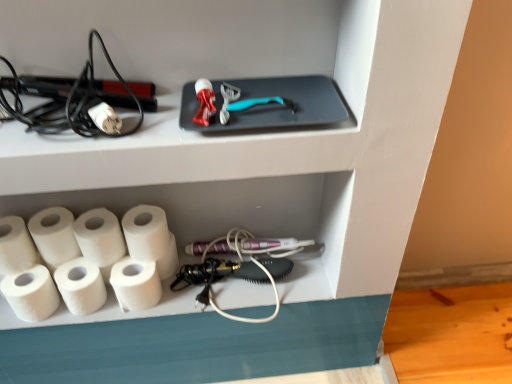
Image resolution: width=512 pixels, height=384 pixels. Describe the element at coordinates (234, 216) in the screenshot. I see `white matte toilet paper rolls at lower left` at that location.

How much space does white matte paper towel at lower left, placed as the 2th paper towel when sorted from right to left, occupy horizontally?

It is 3.84 inches.

Image resolution: width=512 pixels, height=384 pixels. Describe the element at coordinates (136, 284) in the screenshot. I see `white matte paper towel at lower left, placed as the 2th paper towel when sorted from right to left` at that location.

The width and height of the screenshot is (512, 384). What do you see at coordinates (31, 293) in the screenshot? I see `white matte paper towel at lower left, arranged as the 6th paper towel when viewed from the right` at bounding box center [31, 293].

Describe the element at coordinates (54, 236) in the screenshot. Image resolution: width=512 pixels, height=384 pixels. I see `white matte paper towel at lower left, which ranks as the fifth paper towel in right-to-left order` at that location.

The width and height of the screenshot is (512, 384). What are the coordinates of `white matte paper towel at lower left, the 7th paper towel from the right` in the screenshot? It's located at (15, 246).

The width and height of the screenshot is (512, 384). Identify the location of white matte paper towel at lower left, acting as the third paper towel starting from the right. (100, 237).

Based on the photo, how different are the orientations of white matte paper towel at lower left, acting as the fifth paper towel starting from the left, and white matte toilet paper rolls at lower left in degrees?

The facing directions of white matte paper towel at lower left, acting as the fifth paper towel starting from the left, and white matte toilet paper rolls at lower left are 1.46 degrees apart.

From a real-world perspective, which paper towel is the 6th one above the white matte toilet paper rolls at lower left? Please provide its 2D coordinates.

[(100, 237)]

Does point (103, 251) appear closer or farther from the camera than point (326, 248)?

Point (103, 251) is positioned closer to the camera compared to point (326, 248).

From the image's perspective, between white matte paper towel at lower left, acting as the third paper towel starting from the right, and white matte toilet paper rolls at lower left, who is located below?

From the image's view, white matte toilet paper rolls at lower left is below.

Locate an element on the screen. the 3rd paper towel to the left of the white matte paper towel at lower left, placed as the 2th paper towel when sorted from right to left, starting your count from the anchor is located at coordinates (54, 236).

Which of these two, white matte paper towel at lower left, which ranks as the fifth paper towel in right-to-left order, or white matte paper towel at lower left, placed as the sixth paper towel when sorted from left to right, is thinner?

white matte paper towel at lower left, placed as the sixth paper towel when sorted from left to right, is thinner.

Does white matte paper towel at lower left, which ranks as the fifth paper towel in right-to-left order, have a larger size compared to white matte paper towel at lower left, placed as the 2th paper towel when sorted from right to left?

Yes.

Which object is more forward, white matte paper towel at lower left, marked as the fourth paper towel in a right-to-left arrangement, or white matte paper towel at lower left, positioned as the seventh paper towel in left-to-right order?

white matte paper towel at lower left, marked as the fourth paper towel in a right-to-left arrangement, is more forward.

What's the angular difference between white matte paper towel at lower left, marked as the fourth paper towel in a right-to-left arrangement, and white matte paper towel at lower left, the first paper towel when ordered from right to left,'s facing directions?

white matte paper towel at lower left, marked as the fourth paper towel in a right-to-left arrangement, and white matte paper towel at lower left, the first paper towel when ordered from right to left, are facing 0.000244 degrees away from each other.

Which is nearer, [88,264] or [143,221]?

The point [143,221] is closer.

Based on their positions, is white matte paper towel at lower left, marked as the fourth paper towel in a right-to-left arrangement, located to the left or right of white matte paper towel at lower left, the first paper towel when ordered from right to left?

white matte paper towel at lower left, marked as the fourth paper towel in a right-to-left arrangement, is to the left of white matte paper towel at lower left, the first paper towel when ordered from right to left.

Between white matte toilet paper rolls at lower left and white matte paper towel at lower left, placed as the sixth paper towel when sorted from left to right, which one appears on the left side from the viewer's perspective?

white matte paper towel at lower left, placed as the sixth paper towel when sorted from left to right.

From a real-world perspective, is white matte toilet paper rolls at lower left located beneath white matte paper towel at lower left, placed as the 2th paper towel when sorted from right to left?

Yes, from a real-world perspective, white matte toilet paper rolls at lower left is below white matte paper towel at lower left, placed as the 2th paper towel when sorted from right to left.

Is point (224, 201) in front of point (140, 263)?

No.

In the image, is white matte toilet paper rolls at lower left positioned in front of or behind white matte paper towel at lower left, placed as the 2th paper towel when sorted from right to left?

Clearly, white matte toilet paper rolls at lower left is behind white matte paper towel at lower left, placed as the 2th paper towel when sorted from right to left.

Can you confirm if black plastic hair straightener at left is wider than white matte paper towel at lower left, which ranks as the fifth paper towel in right-to-left order?

Correct, the width of black plastic hair straightener at left exceeds that of white matte paper towel at lower left, which ranks as the fifth paper towel in right-to-left order.

From a real-world perspective, who is located lower, black plastic hair straightener at left or white matte paper towel at lower left, which ranks as the fifth paper towel in right-to-left order?

white matte paper towel at lower left, which ranks as the fifth paper towel in right-to-left order, is physically lower.

Looking at this image, which object is further away from the camera taking this photo, black plastic hair straightener at left or white matte paper towel at lower left, the 3th paper towel from the left?

white matte paper towel at lower left, the 3th paper towel from the left, is further from the camera.

Can we say black plastic hair straightener at left lies outside white matte paper towel at lower left, the 3th paper towel from the left?

Absolutely, black plastic hair straightener at left is external to white matte paper towel at lower left, the 3th paper towel from the left.

Is white matte toilet paper rolls at lower left surrounding white matte paper towel at lower left, the first paper towel when ordered from right to left?

That's incorrect, white matte paper towel at lower left, the first paper towel when ordered from right to left, is not inside white matte toilet paper rolls at lower left.

Where is `shelf below the white matte paper towel at lower left, positioned as the seventh paper towel in left-to-right order (from a real-world perspective)`? The image size is (512, 384). shelf below the white matte paper towel at lower left, positioned as the seventh paper towel in left-to-right order (from a real-world perspective) is located at coordinates (234, 216).

In the scene shown: Is white matte toilet paper rolls at lower left far away from white matte paper towel at lower left, positioned as the seventh paper towel in left-to-right order?

white matte toilet paper rolls at lower left is near white matte paper towel at lower left, positioned as the seventh paper towel in left-to-right order, not far away.

From the picture: Is white matte toilet paper rolls at lower left turned away from white matte paper towel at lower left, the first paper towel when ordered from right to left?

That's not correct — white matte toilet paper rolls at lower left is not looking away from white matte paper towel at lower left, the first paper towel when ordered from right to left.

Is white matte paper towel at lower left, positioned as the seventh paper towel in left-to-right order, shorter than white matte paper towel at lower left, arranged as the 6th paper towel when viewed from the right?

No, white matte paper towel at lower left, positioned as the seventh paper towel in left-to-right order, is not shorter than white matte paper towel at lower left, arranged as the 6th paper towel when viewed from the right.

What are the coordinates of `the 5th paper towel positioned above the white matte paper towel at lower left, arranged as the 6th paper towel when viewed from the right (from a real-world perspective)` in the screenshot? It's located at (146, 232).

In the scene shown: From a real-world perspective, is white matte paper towel at lower left, the first paper towel when ordered from right to left, physically below white matte paper towel at lower left, arranged as the 6th paper towel when viewed from the right?

No, from a real-world perspective, white matte paper towel at lower left, the first paper towel when ordered from right to left, is not beneath white matte paper towel at lower left, arranged as the 6th paper towel when viewed from the right.

Between white matte paper towel at lower left, positioned as the seventh paper towel in left-to-right order, and white matte paper towel at lower left, arranged as the 6th paper towel when viewed from the right, which one has smaller width?

white matte paper towel at lower left, arranged as the 6th paper towel when viewed from the right, is thinner.

Find the location of a particular element. This screenshot has height=384, width=512. the 3rd paper towel to the left when counting from the white matte toilet paper rolls at lower left is located at coordinates (100, 237).

From the image's perspective, count 3rd paper towels downward from the white matte paper towel at lower left, which ranks as the fifth paper towel in right-to-left order, and point to it. Please provide its 2D coordinates.

[(136, 284)]

Based on their spatial positions, is white matte toilet paper rolls at lower left or white matte paper towel at lower left, which ranks as the fifth paper towel in right-to-left order, closer to white matte paper towel at lower left, positioned as the seventh paper towel in left-to-right order?

white matte paper towel at lower left, which ranks as the fifth paper towel in right-to-left order, is closer to white matte paper towel at lower left, positioned as the seventh paper towel in left-to-right order.

Consider the image. Estimate the real-world distances between objects in this image. Which object is further from white matte toilet paper rolls at lower left, black plastic hair straightener at left or white matte paper towel at lower left, acting as the fifth paper towel starting from the left?

black plastic hair straightener at left is positioned further to the anchor white matte toilet paper rolls at lower left.

When comparing their distances from white matte paper towel at lower left, acting as the 2th paper towel starting from the left, does white matte paper towel at lower left, positioned as the seventh paper towel in left-to-right order, or white matte paper towel at lower left, the 7th paper towel from the right, seem closer?

white matte paper towel at lower left, the 7th paper towel from the right, is closer to white matte paper towel at lower left, acting as the 2th paper towel starting from the left.

Based on their spatial positions, is white matte paper towel at lower left, positioned as the seventh paper towel in left-to-right order, or white matte paper towel at lower left, acting as the 2th paper towel starting from the left, closer to white matte paper towel at lower left, which ranks as the fifth paper towel in right-to-left order?

Among the two, white matte paper towel at lower left, acting as the 2th paper towel starting from the left, is located nearer to white matte paper towel at lower left, which ranks as the fifth paper towel in right-to-left order.

Consider the image. From the image, which object appears to be nearer to black plastic hair straightener at left, white matte paper towel at lower left, the first paper towel when ordered from right to left, or white matte paper towel at lower left, placed as the sixth paper towel when sorted from left to right?

white matte paper towel at lower left, the first paper towel when ordered from right to left, is closer to black plastic hair straightener at left.

Estimate the real-world distances between objects in this image. Which object is closer to white matte paper towel at lower left, the first paper towel when ordered from right to left, white matte paper towel at lower left, the 3th paper towel from the left, or white matte paper towel at lower left, arranged as the 6th paper towel when viewed from the right?

white matte paper towel at lower left, the 3th paper towel from the left, is closer to white matte paper towel at lower left, the first paper towel when ordered from right to left.

Looking at the image, which one is located further to white matte paper towel at lower left, the first paper towel when ordered from right to left, white matte paper towel at lower left, arranged as the fourth paper towel when viewed from the left, or white matte toilet paper rolls at lower left?

Among the two, white matte toilet paper rolls at lower left is located further to white matte paper towel at lower left, the first paper towel when ordered from right to left.

Based on their spatial positions, is black plastic hair straightener at left or white matte paper towel at lower left, positioned as the first paper towel in left-to-right order, further from white matte paper towel at lower left, arranged as the fourth paper towel when viewed from the left?

black plastic hair straightener at left lies further to white matte paper towel at lower left, arranged as the fourth paper towel when viewed from the left, than the other object.

At what (x,y) coordinates should I click in order to perform the action: click on shelf between black plastic hair straightener at left and white matte paper towel at lower left, acting as the 2th paper towel starting from the left, vertically. Please return your answer as a coordinate pair (x, y). Looking at the image, I should click on (234, 216).

Image resolution: width=512 pixels, height=384 pixels. Find the location of `paper towel between white matte paper towel at lower left, marked as the fourth paper towel in a right-to-left arrangement, and white matte paper towel at lower left, placed as the 2th paper towel when sorted from right to left, from left to right`. paper towel between white matte paper towel at lower left, marked as the fourth paper towel in a right-to-left arrangement, and white matte paper towel at lower left, placed as the 2th paper towel when sorted from right to left, from left to right is located at coordinates (100, 237).